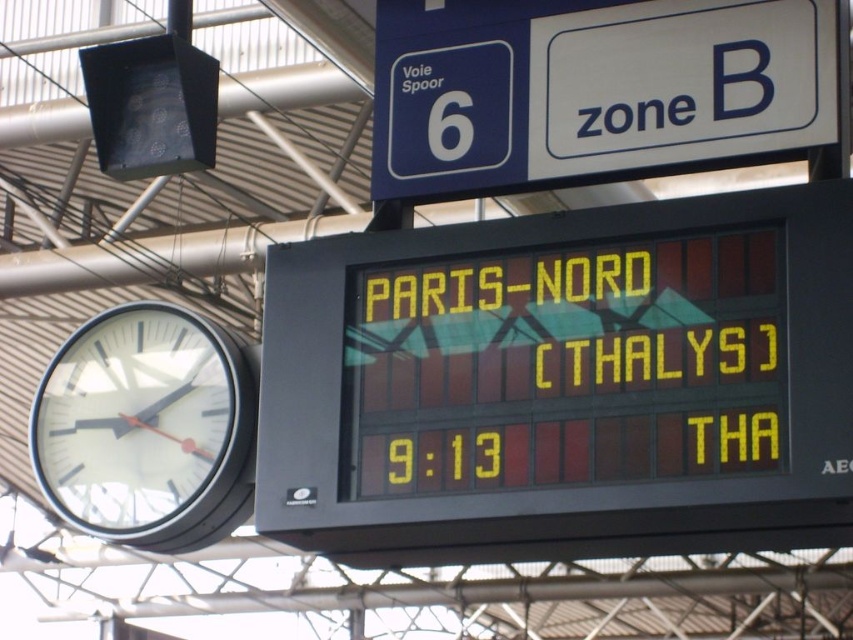
Is point (426, 490) positioned behind point (657, 115)?

No.

Between yellow led display at center and blue plastic sign at upper center, which one is positioned higher?

blue plastic sign at upper center

This screenshot has height=640, width=853. In order to click on yellow led display at center in this screenshot , I will do `click(564, 384)`.

Does point (544, 502) lie in front of point (108, 468)?

Yes, it is.

At what (x,y) coordinates should I click in order to perform the action: click on yellow led display at center. Please return your answer as a coordinate pair (x, y). The height and width of the screenshot is (640, 853). Looking at the image, I should click on (564, 384).

Where is `yellow led display at center`? Image resolution: width=853 pixels, height=640 pixels. yellow led display at center is located at coordinates 564,384.

Is point (720, 106) positioned after point (184, 403)?

No, (720, 106) is closer to viewer.

Describe the element at coordinates (592, 90) in the screenshot. This screenshot has width=853, height=640. I see `blue plastic sign at upper center` at that location.

This screenshot has width=853, height=640. I want to click on blue plastic sign at upper center, so click(x=592, y=90).